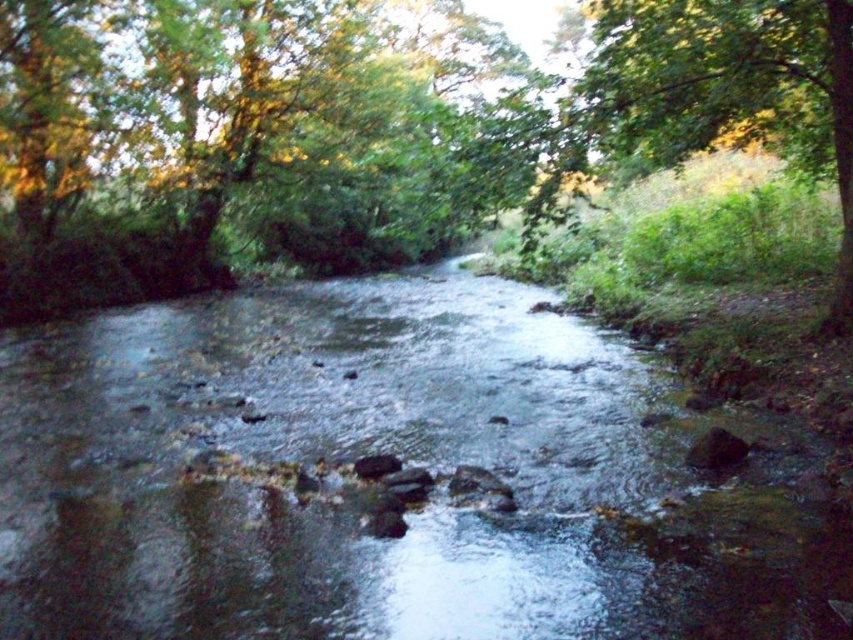
Question: Is clear water at center positioned before green leafy tree at center?

Choices:
 (A) no
 (B) yes

Answer: (B)

Question: Can you confirm if clear water at center is bigger than green leafy tree at center?

Choices:
 (A) no
 (B) yes

Answer: (A)

Question: Is clear water at center bigger than green leafy tree at center?

Choices:
 (A) yes
 (B) no

Answer: (B)

Question: Which point appears farthest from the camera in this image?

Choices:
 (A) (339, 129)
 (B) (165, 442)

Answer: (A)

Question: Which of the following is the closest to the observer?

Choices:
 (A) green leafy tree at center
 (B) clear water at center

Answer: (B)